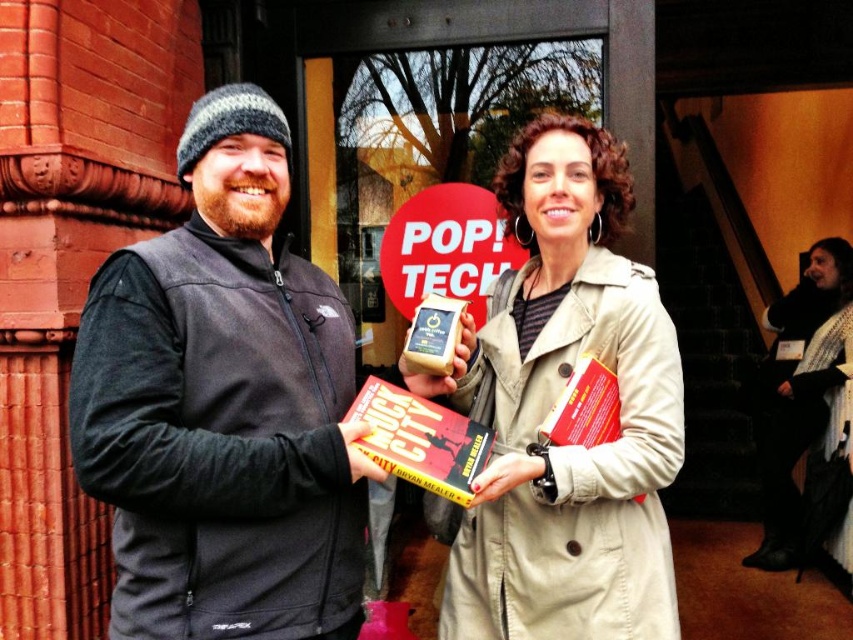
Does black knit sweater at lower right have a lesser width compared to red paper sign at center?

No, black knit sweater at lower right is not thinner than red paper sign at center.

Measure the distance from black knit sweater at lower right to red paper sign at center.

8.05 feet

Locate an element on the screen. black knit sweater at lower right is located at coordinates (798, 390).

Does point (233, 502) lie in front of point (421, 244)?

Yes, it is in front of point (421, 244).

Is black fleece vest at center bigger than red paper sign at center?

Correct, black fleece vest at center is larger in size than red paper sign at center.

Between point (273, 428) and point (498, 227), which one is positioned behind?

Point (498, 227)

Where is `black fleece vest at center`? The height and width of the screenshot is (640, 853). black fleece vest at center is located at coordinates (223, 406).

Based on the photo, which is more to the right, beige trench coat at center or black knit sweater at lower right?

Positioned to the right is black knit sweater at lower right.

Between point (469, 525) and point (817, 349), which one is positioned in front?

Point (469, 525)

Locate an element on the screen. Image resolution: width=853 pixels, height=640 pixels. beige trench coat at center is located at coordinates (552, 406).